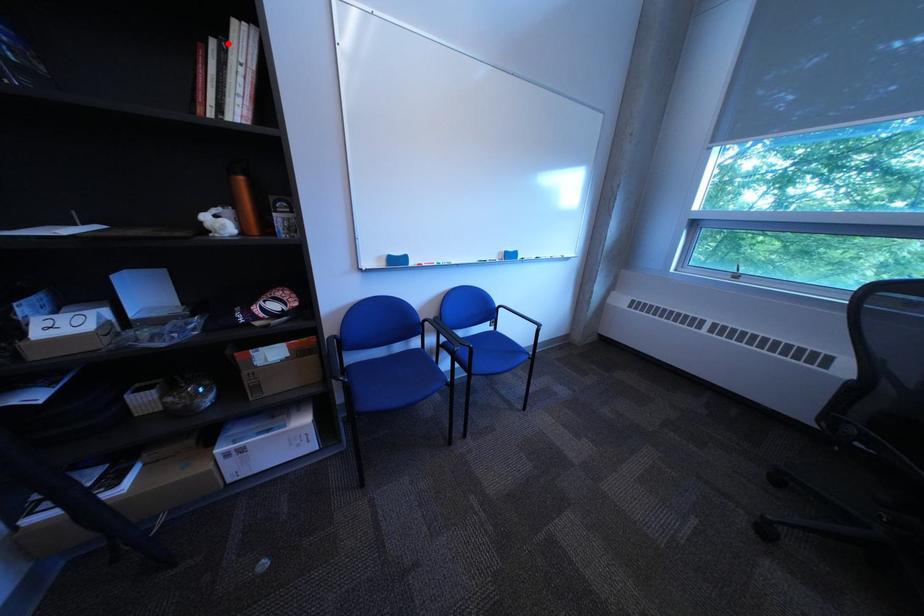
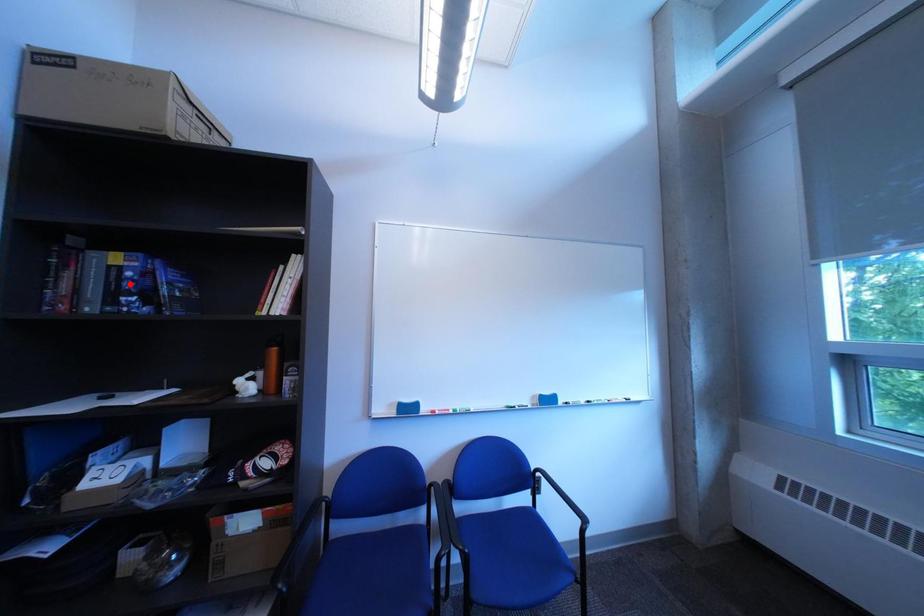
I am providing you with two images of the same scene from different viewpoints. A red point is marked on the first image and another point is marked on the second image. Does the point marked in image1 correspond to the same location as the one in image2?

No